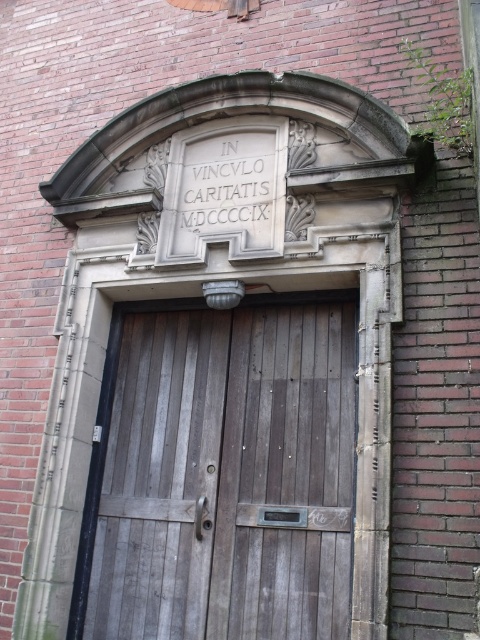
Consider the image. You are standing in front of a building and see the wooden door at center and the white stone inscription at center. Which object is positioned to the left?

The wooden door at center is to the left of white stone inscription at center.

You are standing in front of the building and want to read the white stone inscription at center. Can you see it clearly through the wooden door at center?

The wooden door at center is in front of the white stone inscription at center, so you cannot see the inscription clearly through the door.